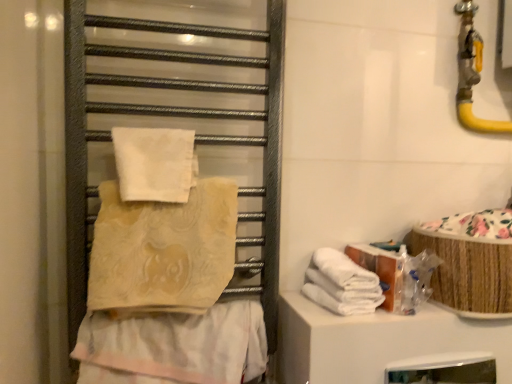
Question: Which direction should I rotate to look at white soft towel at upper center, which is the first towel in top-to-bottom order?

Choices:
 (A) right
 (B) left

Answer: (B)

Question: Which direction should I rotate to face beige textured towel at center, arranged as the 1th towel when ordered from the bottom, — up or down?

Choices:
 (A) up
 (B) down

Answer: (B)

Question: Is beige textured towel at center, arranged as the 1th towel when ordered from the bottom, oriented towards white soft towel at upper center, which is the first towel in top-to-bottom order?

Choices:
 (A) no
 (B) yes

Answer: (A)

Question: From a real-world perspective, is beige textured towel at center, arranged as the 1th towel when ordered from the bottom, physically below white soft towel at upper center, which is the first towel in top-to-bottom order?

Choices:
 (A) no
 (B) yes

Answer: (B)

Question: Is beige textured towel at center, arranged as the 1th towel when ordered from the bottom, positioned before white soft towel at upper center, which is the first towel in top-to-bottom order?

Choices:
 (A) yes
 (B) no

Answer: (A)

Question: Can you confirm if beige textured towel at center, the fourth towel positioned from the top, is smaller than white soft towel at upper center, which is the first towel in top-to-bottom order?

Choices:
 (A) yes
 (B) no

Answer: (B)

Question: Does beige textured towel at center, the fourth towel positioned from the top, have a greater height compared to white soft towel at upper center, marked as the 4th towel in a bottom-to-top arrangement?

Choices:
 (A) no
 (B) yes

Answer: (B)

Question: Is the surface of beige textured towel at center, the fourth towel positioned from the top, in direct contact with white soft towel at upper center, marked as the 4th towel in a bottom-to-top arrangement?

Choices:
 (A) yes
 (B) no

Answer: (B)

Question: Is metallic towel rack at left oriented away from white soft towel at upper center, which is the first towel in top-to-bottom order?

Choices:
 (A) no
 (B) yes

Answer: (B)

Question: Does metallic towel rack at left have a larger size compared to white soft towel at upper center, which is the first towel in top-to-bottom order?

Choices:
 (A) no
 (B) yes

Answer: (B)

Question: Would you say metallic towel rack at left is outside white soft towel at upper center, marked as the 4th towel in a bottom-to-top arrangement?

Choices:
 (A) yes
 (B) no

Answer: (A)

Question: Considering the relative sizes of metallic towel rack at left and white soft towel at upper center, which is the first towel in top-to-bottom order, in the image provided, is metallic towel rack at left taller than white soft towel at upper center, which is the first towel in top-to-bottom order,?

Choices:
 (A) no
 (B) yes

Answer: (B)

Question: Is metallic towel rack at left wider than white soft towel at upper center, marked as the 4th towel in a bottom-to-top arrangement?

Choices:
 (A) yes
 (B) no

Answer: (A)

Question: Is metallic towel rack at left smaller than white soft towel at upper center, marked as the 4th towel in a bottom-to-top arrangement?

Choices:
 (A) no
 (B) yes

Answer: (A)

Question: Considering the relative sizes of white soft towel at upper center, which is the first towel in top-to-bottom order, and metallic towel rack at left in the image provided, is white soft towel at upper center, which is the first towel in top-to-bottom order, bigger than metallic towel rack at left?

Choices:
 (A) no
 (B) yes

Answer: (A)